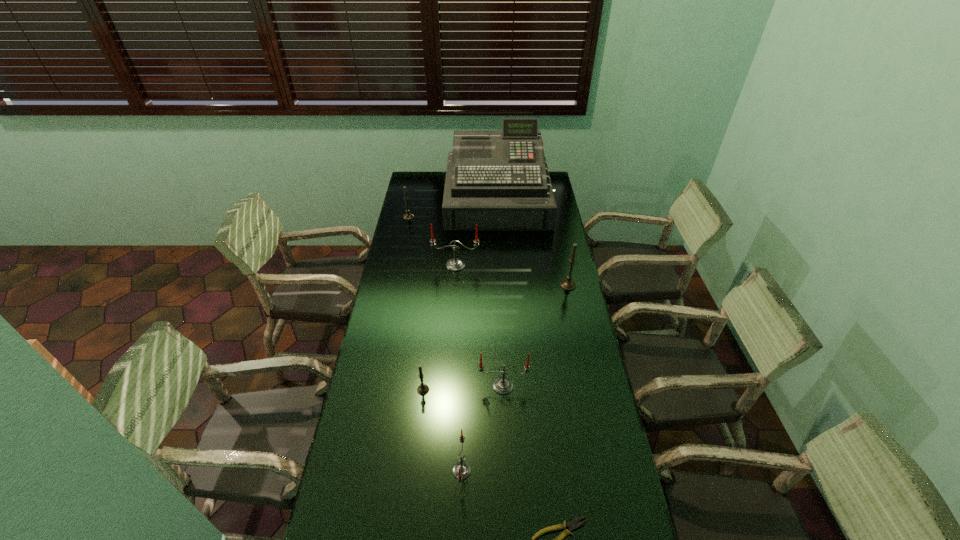
Locate an element on the screen. the tallest object is located at coordinates (498, 179).

At what (x,y) coordinates should I click in order to perform the action: click on gray cash register. Please return your answer as a coordinate pair (x, y). Image resolution: width=960 pixels, height=540 pixels. Looking at the image, I should click on (x=498, y=179).

Where is `the biggest red candle`? This screenshot has height=540, width=960. the biggest red candle is located at coordinates (455, 264).

Identify the location of the sixth nearest object. (455, 264).

At what (x,y) coordinates should I click in order to perform the action: click on the third farthest candle. Please return your answer as a coordinate pair (x, y). Looking at the image, I should click on (567, 284).

Image resolution: width=960 pixels, height=540 pixels. In order to click on the rightmost candle in this screenshot , I will do `click(567, 284)`.

Locate an element on the screen. The height and width of the screenshot is (540, 960). the second nearest red candle is located at coordinates (502, 385).

The width and height of the screenshot is (960, 540). I want to click on the second smallest gray candle, so click(x=408, y=216).

I want to click on the farthest gray candle, so click(x=408, y=216).

The height and width of the screenshot is (540, 960). Identify the location of the second gray candle from left to right. (423, 389).